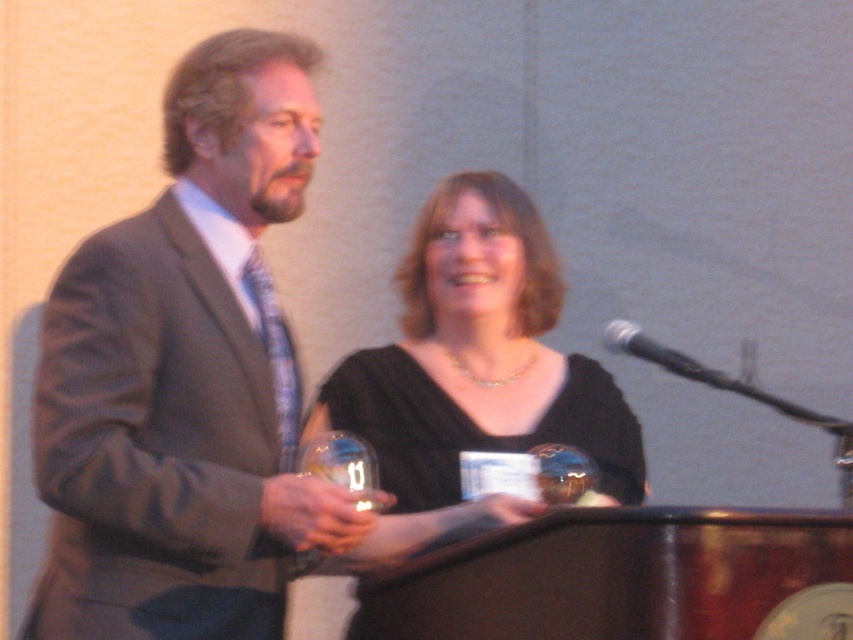
Question: Estimate the real-world distances between objects in this image. Which object is farther from the black matte dress at center?

Choices:
 (A) gray suit at left
 (B) black metallic microphone at center

Answer: (A)

Question: Does gray suit at left lie in front of black metallic microphone at center?

Choices:
 (A) yes
 (B) no

Answer: (A)

Question: Does gray suit at left come in front of black metallic microphone at center?

Choices:
 (A) yes
 (B) no

Answer: (A)

Question: Which point appears farthest from the camera in this image?

Choices:
 (A) (99, 410)
 (B) (706, 365)

Answer: (B)

Question: Which object is positioned farthest from the black matte dress at center?

Choices:
 (A) gray suit at left
 (B) black metallic microphone at center

Answer: (A)

Question: Is gray suit at left closer to the viewer compared to black metallic microphone at center?

Choices:
 (A) yes
 (B) no

Answer: (A)